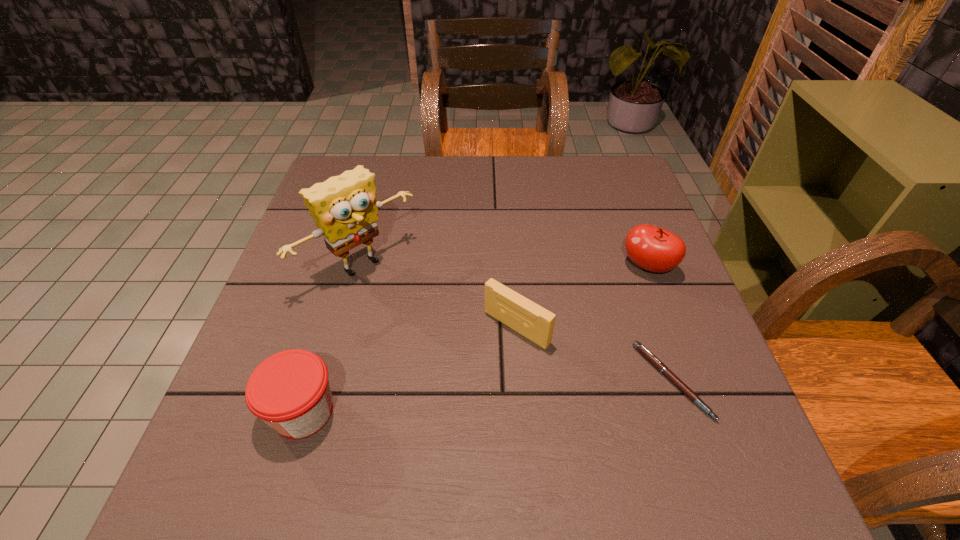
Where is `blank space located 0.120m at the front of the third object from left to right with spools`? Image resolution: width=960 pixels, height=540 pixels. blank space located 0.120m at the front of the third object from left to right with spools is located at coordinates tap(457, 387).

This screenshot has width=960, height=540. Find the location of `vacant space located 0.130m at the front of the third object from left to right with spools`. vacant space located 0.130m at the front of the third object from left to right with spools is located at coordinates (453, 390).

I want to click on free location located 0.080m at the front of the third object from left to right with spools, so click(x=471, y=372).

Locate an element on the screen. Image resolution: width=960 pixels, height=540 pixels. vacant space situated on the face of the tallest object is located at coordinates (435, 334).

Where is `vacant space situated 0.290m on the face of the tallest object`? vacant space situated 0.290m on the face of the tallest object is located at coordinates click(482, 379).

Identify the location of vacant space positioned 0.090m on the face of the tallest object. (417, 316).

Where is `jam at the near edge`? The image size is (960, 540). jam at the near edge is located at coordinates [x=290, y=391].

Where is `pen positioned at the near edge`? pen positioned at the near edge is located at coordinates (658, 364).

The height and width of the screenshot is (540, 960). I want to click on jam that is at the left edge, so click(x=290, y=391).

At what (x,y) coordinates should I click in order to perform the action: click on sponge located in the left edge section of the desktop. Please return your answer as a coordinate pair (x, y). Looking at the image, I should click on (345, 207).